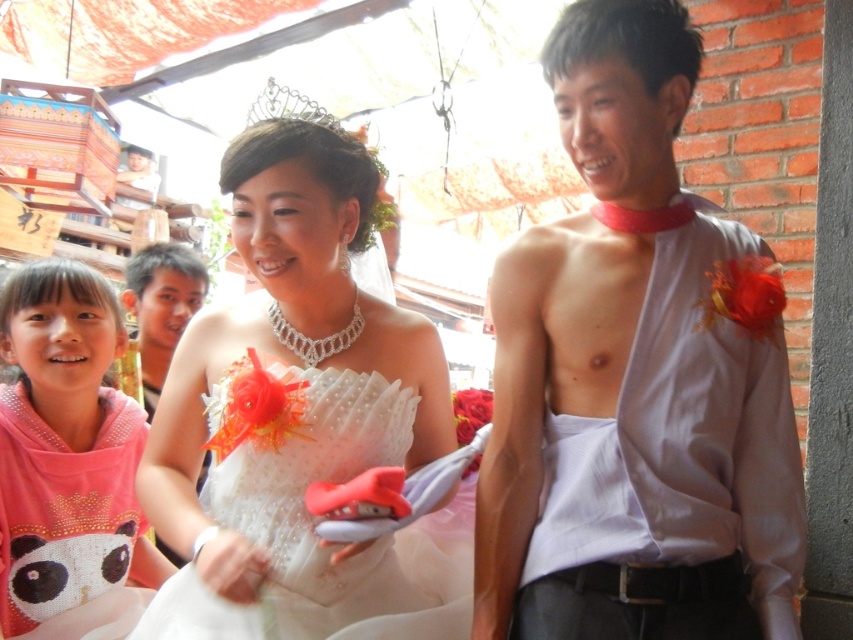
Question: Is matte gray shirt at right wider than pink fabric at left?

Choices:
 (A) yes
 (B) no

Answer: (A)

Question: Which object is the closest to the matte black hair at upper left?

Choices:
 (A) white satin dress at center
 (B) matte gray shirt at right

Answer: (A)

Question: Estimate the real-world distances between objects in this image. Which object is closer to the matte black hair at upper left?

Choices:
 (A) white satin dress at center
 (B) pink fabric at left
 (C) matte gray shirt at right

Answer: (B)

Question: Estimate the real-world distances between objects in this image. Which object is farther from the pink fabric at left?

Choices:
 (A) white satin dress at center
 (B) matte gray shirt at right
 (C) matte black hair at upper left

Answer: (B)

Question: Does pink fabric at left have a greater width compared to matte black hair at upper left?

Choices:
 (A) no
 (B) yes

Answer: (B)

Question: Does matte gray shirt at right have a larger size compared to matte black hair at upper left?

Choices:
 (A) no
 (B) yes

Answer: (B)